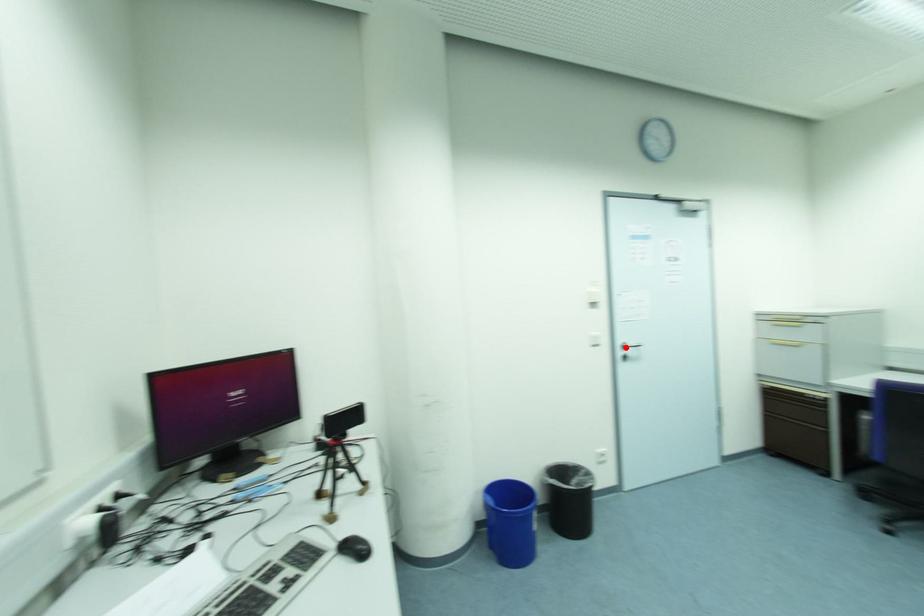
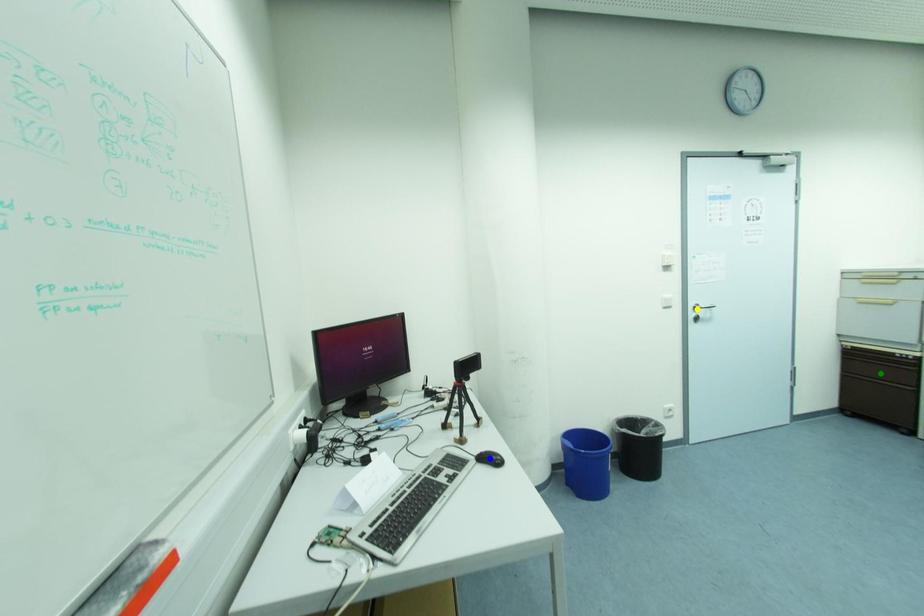
Question: I am providing you with two images of the same scene from different viewpoints. A red point is marked on the first image. You are given multiple points on the second image. Which spot in image 2 lines up with the point in image 1?

Choices:
 (A) blue point
 (B) yellow point
 (C) green point

Answer: (B)